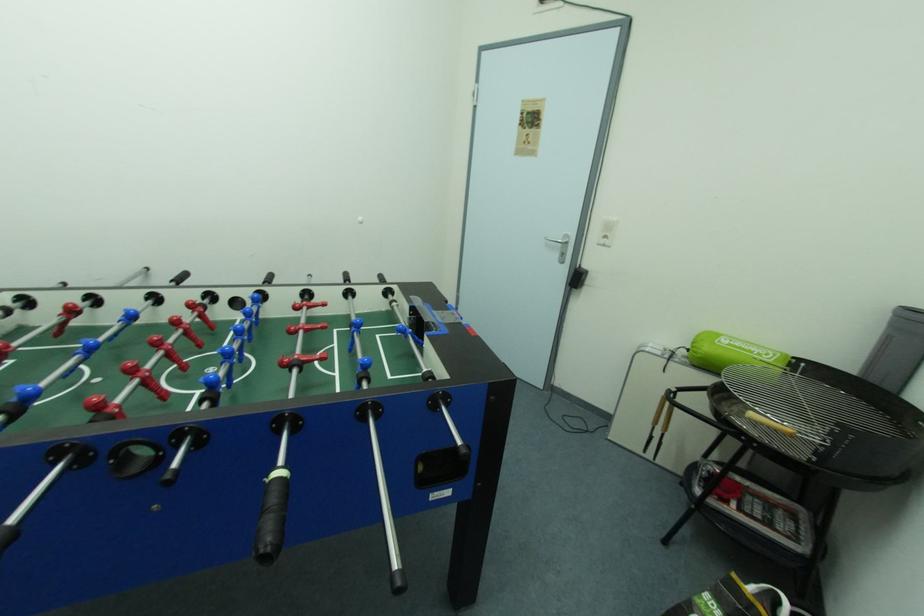
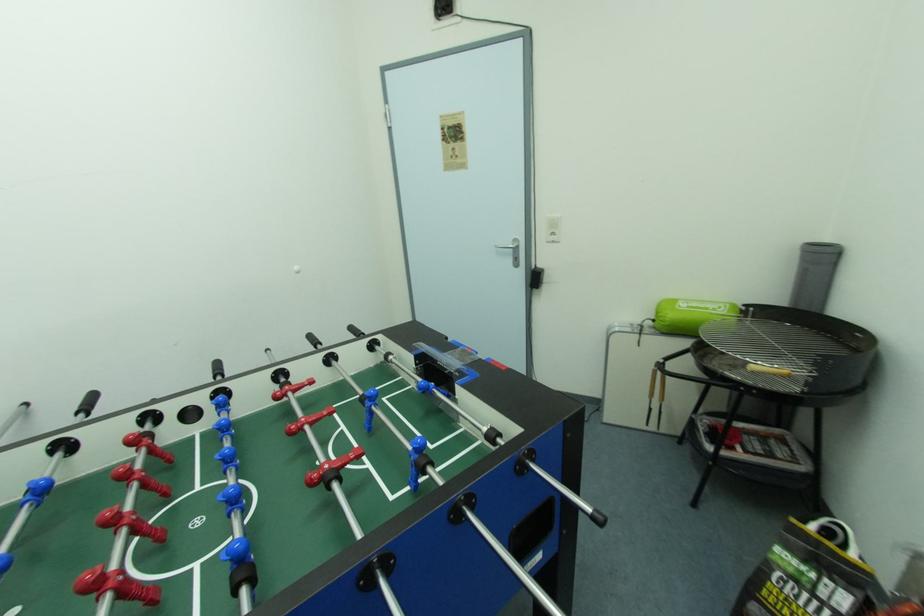
Question: The first image is from the beginning of the video and the second image is from the end. How did the camera likely rotate when shooting the video?

Choices:
 (A) Left
 (B) Right
 (C) Up
 (D) Down

Answer: (B)